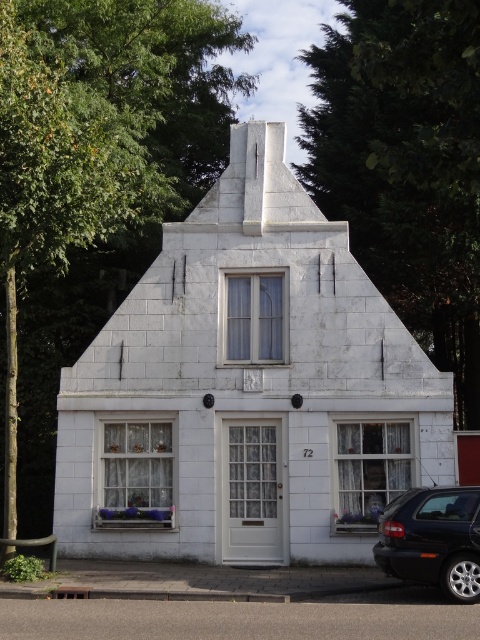
Question: Does green leafy tree at upper left lie in front of shiny black car at lower right?

Choices:
 (A) yes
 (B) no

Answer: (B)

Question: Which point appears farthest from the camera in this image?

Choices:
 (A) (66, 51)
 (B) (374, 266)

Answer: (B)

Question: Does green leafy tree at upper left appear on the left side of green leafy tree at upper right?

Choices:
 (A) yes
 (B) no

Answer: (A)

Question: Is green leafy tree at upper left to the left of shiny black car at lower right from the viewer's perspective?

Choices:
 (A) no
 (B) yes

Answer: (B)

Question: Which point appears closest to the camera in this image?

Choices:
 (A) (6, 406)
 (B) (302, 108)

Answer: (A)

Question: Which object is closer to the camera taking this photo?

Choices:
 (A) shiny black car at lower right
 (B) green leafy tree at upper left
 (C) green leafy tree at upper right

Answer: (C)